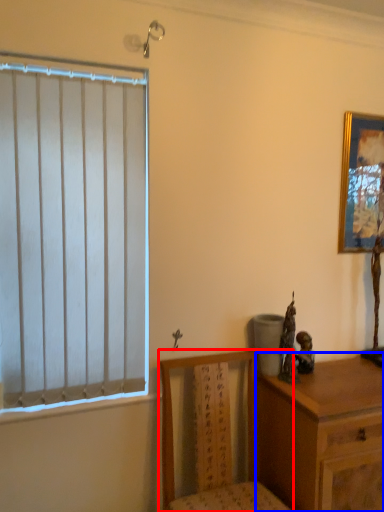
Question: Which object is further to the camera taking this photo, chair (highlighted by a red box) or chest of drawers (highlighted by a blue box)?

Choices:
 (A) chair
 (B) chest of drawers

Answer: (B)